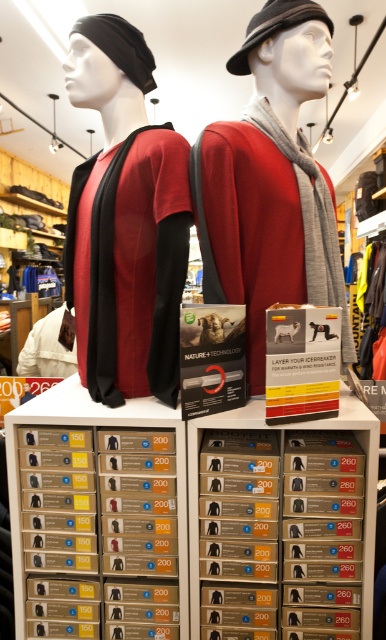
Is matte black t-shirt at left to the right of black felt hat at upper center from the viewer's perspective?

Incorrect, matte black t-shirt at left is not on the right side of black felt hat at upper center.

Which of these two, matte black t-shirt at left or black felt hat at upper center, stands shorter?

With less height is black felt hat at upper center.

Measure the distance between matte black t-shirt at left and camera.

The distance of matte black t-shirt at left from camera is 4.00 feet.

Identify the location of matte black t-shirt at left. The width and height of the screenshot is (386, 640). (125, 221).

Which is above, black felt hat at upper center or white fabric shirt at center?

black felt hat at upper center

Which is below, black felt hat at upper center or white fabric shirt at center?

white fabric shirt at center

Is point (281, 3) closer to viewer compared to point (76, 344)?

Yes, point (281, 3) is closer to viewer.

What are the coordinates of `black felt hat at upper center` in the screenshot? It's located at (x=274, y=26).

Does black fabric beanie at upper left have a lesser height compared to white fabric shirt at center?

Yes, black fabric beanie at upper left is shorter than white fabric shirt at center.

Does black fabric beanie at upper left appear on the right side of white fabric shirt at center?

Indeed, black fabric beanie at upper left is positioned on the right side of white fabric shirt at center.

Which is behind, point (84, 26) or point (38, 321)?

Positioned behind is point (38, 321).

You are a GUI agent. You are given a task and a screenshot of the screen. Output one action in this format:
    pyautogui.click(x=<x>, y=<y>)
    Task: Click on the black fabric beanie at upper left
    
    Given the screenshot: What is the action you would take?
    pyautogui.click(x=120, y=45)